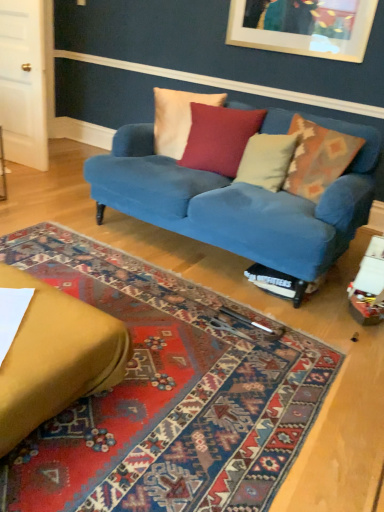
Question: From a real-world perspective, is white cotton pillow at center, which is the fourth pillow from right to left, physically above white soft pillow at center, the second pillow from the right?

Choices:
 (A) yes
 (B) no

Answer: (A)

Question: Is white cotton pillow at center, which is the fourth pillow from right to left, wider than white soft pillow at center, which is counted as the third pillow, starting from the left?

Choices:
 (A) no
 (B) yes

Answer: (A)

Question: Is white cotton pillow at center, the first pillow viewed from the left, next to white soft pillow at center, the second pillow from the right?

Choices:
 (A) no
 (B) yes

Answer: (A)

Question: Is white cotton pillow at center, the first pillow viewed from the left, behind white soft pillow at center, the second pillow from the right?

Choices:
 (A) yes
 (B) no

Answer: (A)

Question: Can you confirm if white cotton pillow at center, the first pillow viewed from the left, is positioned to the left of white soft pillow at center, which is counted as the third pillow, starting from the left?

Choices:
 (A) no
 (B) yes

Answer: (B)

Question: Is point (274, 158) positioned closer to the camera than point (249, 314)?

Choices:
 (A) farther
 (B) closer

Answer: (A)

Question: Looking at the image, does white soft pillow at center, the second pillow from the right, seem bigger or smaller compared to carpeted rug at center?

Choices:
 (A) big
 (B) small

Answer: (B)

Question: In the image, is white soft pillow at center, the second pillow from the right, on the left side or the right side of carpeted rug at center?

Choices:
 (A) left
 (B) right

Answer: (B)

Question: In the image, is white soft pillow at center, which is counted as the third pillow, starting from the left, positioned in front of or behind carpeted rug at center?

Choices:
 (A) behind
 (B) front

Answer: (A)

Question: From the image's perspective, is white soft pillow at center, the second pillow from the right, positioned above or below velvet blue couch at center, placed as the 1th studio couch when sorted from back to front?

Choices:
 (A) above
 (B) below

Answer: (A)

Question: From a real-world perspective, is white soft pillow at center, the second pillow from the right, physically located above or below velvet blue couch at center, arranged as the 2th studio couch when viewed from the front?

Choices:
 (A) below
 (B) above

Answer: (B)

Question: Looking at their shapes, would you say white soft pillow at center, the second pillow from the right, is wider or thinner than velvet blue couch at center, placed as the 1th studio couch when sorted from back to front?

Choices:
 (A) thin
 (B) wide

Answer: (A)

Question: In the image, is white soft pillow at center, which is counted as the third pillow, starting from the left, positioned in front of or behind velvet blue couch at center, placed as the 1th studio couch when sorted from back to front?

Choices:
 (A) behind
 (B) front

Answer: (A)

Question: Considering the positions of carpeted rug at center and velvet blue couch at center, placed as the 1th studio couch when sorted from back to front, in the image, is carpeted rug at center wider or thinner than velvet blue couch at center, placed as the 1th studio couch when sorted from back to front,?

Choices:
 (A) thin
 (B) wide

Answer: (B)

Question: From their relative heights in the image, would you say carpeted rug at center is taller or shorter than velvet blue couch at center, placed as the 1th studio couch when sorted from back to front?

Choices:
 (A) tall
 (B) short

Answer: (B)